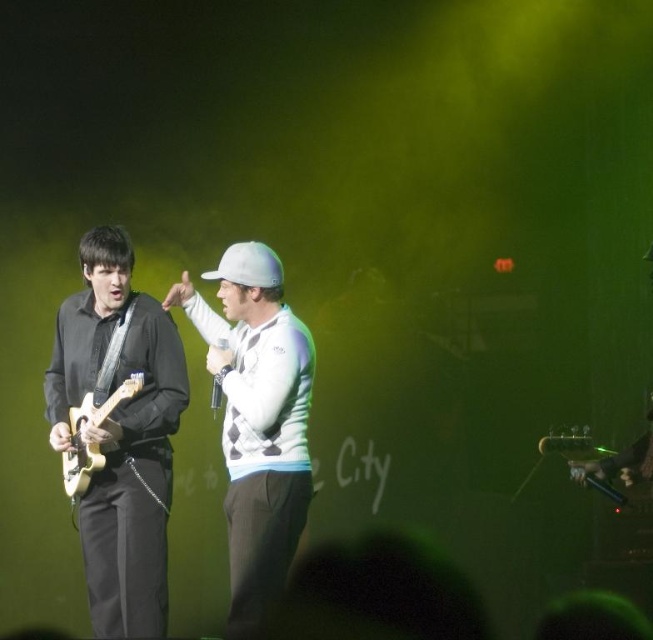
Measure the distance between matte black guitar at left and light wood electric guitar at left.

matte black guitar at left and light wood electric guitar at left are 18.85 centimeters apart from each other.

Does matte black guitar at left have a greater width compared to light wood electric guitar at left?

Yes, matte black guitar at left is wider than light wood electric guitar at left.

Does point (69, 332) lie in front of point (91, 467)?

No.

The height and width of the screenshot is (640, 653). I want to click on matte black guitar at left, so click(119, 433).

Is matte black guitar at left smaller than white textured sweater at center?

Yes.

Can you confirm if matte black guitar at left is positioned to the left of white textured sweater at center?

Correct, you'll find matte black guitar at left to the left of white textured sweater at center.

Which is behind, point (148, 444) or point (276, 440)?

Positioned behind is point (148, 444).

Find the location of a particular element. The height and width of the screenshot is (640, 653). matte black guitar at left is located at coordinates (119, 433).

Is white textured sweater at center thinner than light wood electric guitar at left?

Incorrect, white textured sweater at center's width is not less than light wood electric guitar at left's.

Is point (206, 310) in front of point (99, 445)?

No.

The width and height of the screenshot is (653, 640). I want to click on white textured sweater at center, so click(257, 419).